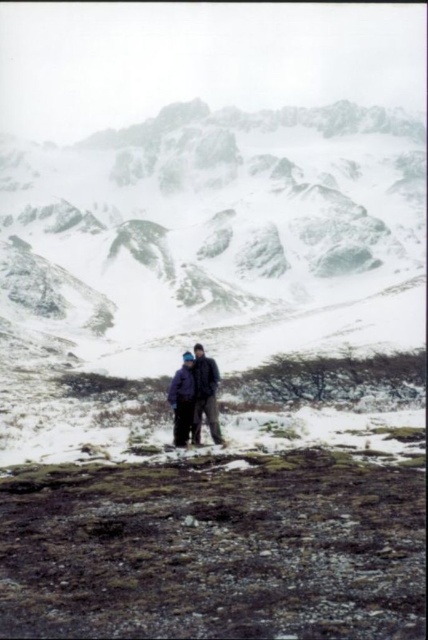
Question: Which point is farther to the camera?

Choices:
 (A) (44, 284)
 (B) (186, 396)
 (C) (178, 413)

Answer: (A)

Question: Is snowy rock mountain at center behind dark blue jacket at center?

Choices:
 (A) yes
 (B) no

Answer: (B)

Question: Estimate the real-world distances between objects in this image. Which object is farther from the snowy rock mountain at center?

Choices:
 (A) matte purple jacket at center
 (B) dark blue jacket at center

Answer: (B)

Question: Is snowy rock mountain at center behind dark blue jacket at center?

Choices:
 (A) no
 (B) yes

Answer: (A)

Question: Which of these objects is positioned farthest from the dark blue jacket at center?

Choices:
 (A) matte purple jacket at center
 (B) snowy rock mountain at center

Answer: (B)

Question: Is matte purple jacket at center to the right of dark blue jacket at center from the viewer's perspective?

Choices:
 (A) yes
 (B) no

Answer: (A)